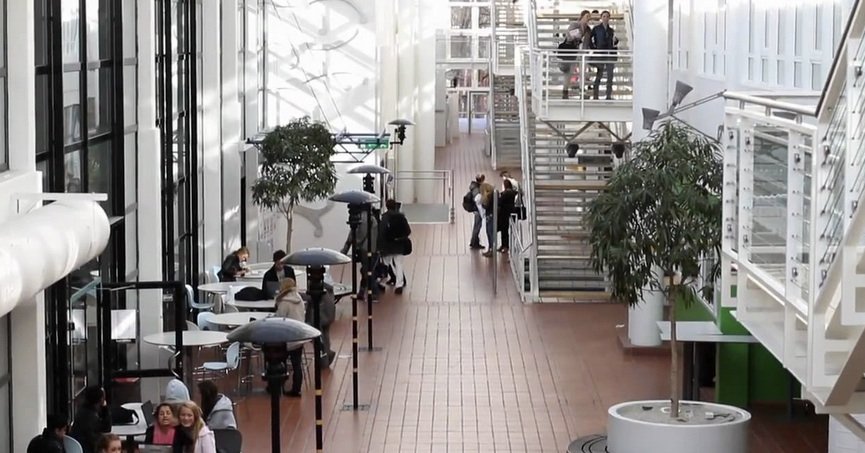
The image size is (865, 453). I want to click on green wall, so click(753, 368).